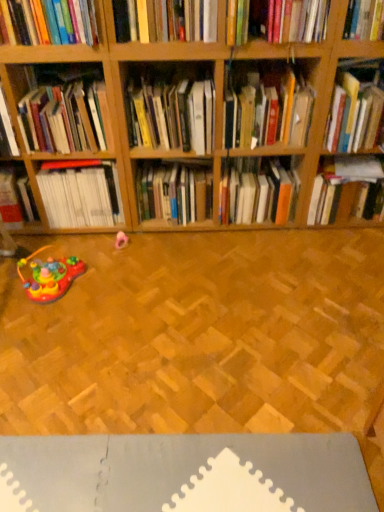
You are a GUI agent. You are given a task and a screenshot of the screen. Output one action in this format:
    pyautogui.click(x=<x>, y=<y>)
    Task: Click on the free area in between rubberized plastic toy at lower left, which appears as the 2th toy when viewed from the top, and gray foam mat at lower center
    
    Given the screenshot: What is the action you would take?
    pyautogui.click(x=134, y=366)